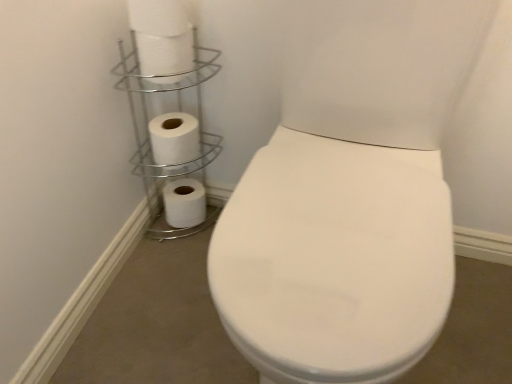
Image resolution: width=512 pixels, height=384 pixels. Identify the location of vacant area situated below silver/metallic toilet paper holder at upper left (from a real-world perspective). (182, 229).